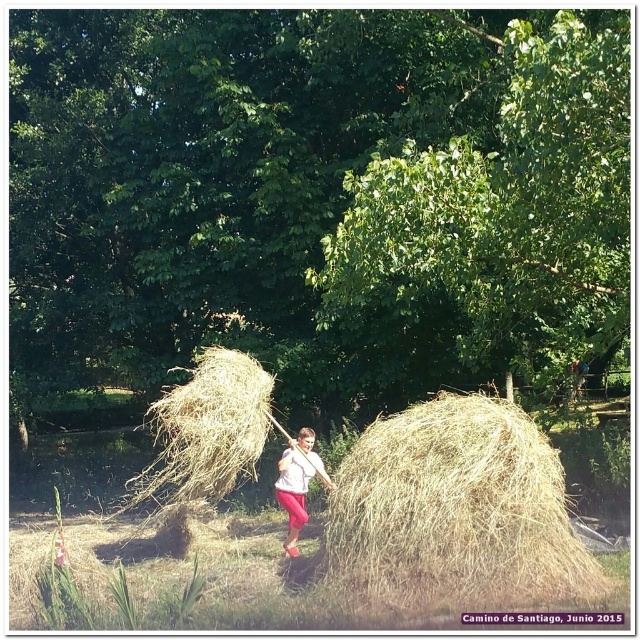
Question: Among these points, which one is farthest from the camera?

Choices:
 (A) (364, 442)
 (B) (298, 444)
 (C) (212, 360)

Answer: (B)

Question: Which point is farther to the camera?

Choices:
 (A) pink fabric girl at center
 (B) dry straw bale at center

Answer: (A)

Question: Which of these objects is positioned closest to the dry straw bale at center?

Choices:
 (A) dry straw at center
 (B) pink fabric girl at center

Answer: (B)

Question: Is dry straw at center to the left of pink fabric girl at center from the viewer's perspective?

Choices:
 (A) no
 (B) yes

Answer: (B)

Question: In this image, where is dry straw bale at center located relative to dry straw at center?

Choices:
 (A) left
 (B) right

Answer: (B)

Question: Considering the relative positions of dry straw bale at center and dry straw at center in the image provided, where is dry straw bale at center located with respect to dry straw at center?

Choices:
 (A) above
 (B) below

Answer: (B)